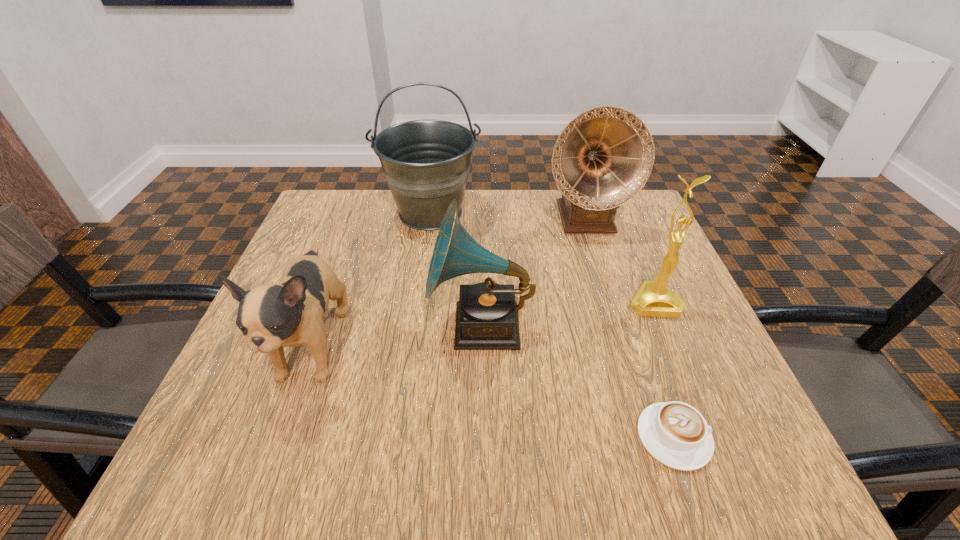
Locate an element on the screen. empty space that is in between the cappuccino and the right phonograph_record is located at coordinates (629, 328).

Identify the location of vacant region between the bucket and the right phonograph_record. (508, 216).

At what (x,y) coordinates should I click in order to perform the action: click on vacant region between the nearer phonograph_record and the cappuccino. Please return your answer as a coordinate pair (x, y). Image resolution: width=960 pixels, height=540 pixels. Looking at the image, I should click on (577, 381).

Locate an element on the screen. This screenshot has height=540, width=960. unoccupied area between the puppy and the nearer phonograph_record is located at coordinates (397, 336).

Where is `free spot between the award and the nearer phonograph_record`? free spot between the award and the nearer phonograph_record is located at coordinates (567, 314).

This screenshot has width=960, height=540. I want to click on blank region between the puppy and the left phonograph_record, so coord(397,336).

Locate an element on the screen. object that is the third closest one to the nearer phonograph_record is located at coordinates (426, 163).

Find the location of a particular element. object that stands as the fourth closest to the bucket is located at coordinates (653, 299).

At what (x,y) coordinates should I click in order to perform the action: click on free region that satisfies the following two spatial constraints: 1. from the horn of the nearer phonograph_record; 2. at the face of the puppy. Please return your answer as a coordinate pair (x, y). This screenshot has height=540, width=960. Looking at the image, I should click on (481, 347).

Where is `free point that satisfies the following two spatial constraints: 1. from the horn of the nearer phonograph_record; 2. at the face of the puppy`? The height and width of the screenshot is (540, 960). free point that satisfies the following two spatial constraints: 1. from the horn of the nearer phonograph_record; 2. at the face of the puppy is located at coordinates (481, 347).